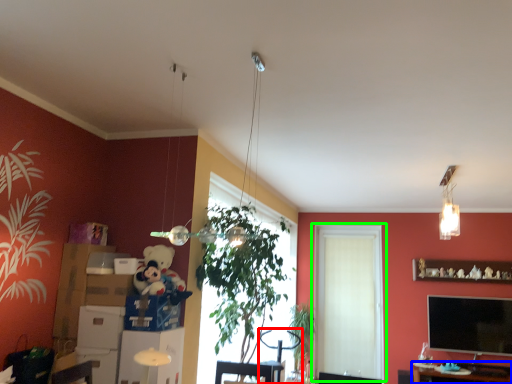
Question: Which object is positioned farthest from swivel chair (highlighted by a red box)? Select from table (highlighted by a blue box) and window (highlighted by a green box).

Choices:
 (A) table
 (B) window

Answer: (A)